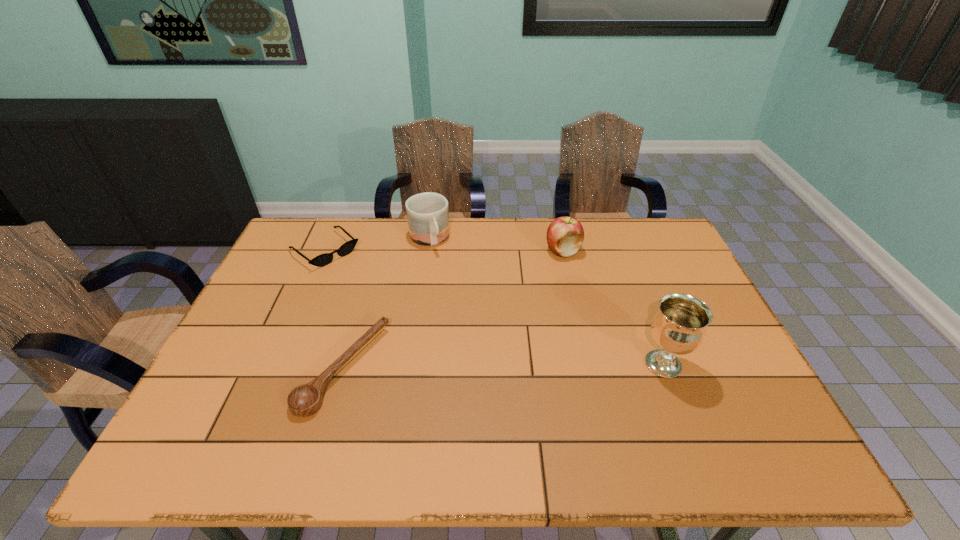
What are the coordinates of `vacant space that's between the tallest object and the wooden spoon` in the screenshot? It's located at (503, 366).

Identify the location of free space between the wooden spoon and the tallest object. The height and width of the screenshot is (540, 960). (503, 366).

I want to click on free space between the tallest object and the apple, so click(612, 307).

Image resolution: width=960 pixels, height=540 pixels. I want to click on free space between the rightmost object and the wooden spoon, so click(x=503, y=366).

The image size is (960, 540). I want to click on vacant space that's between the rightmost object and the sunglasses, so click(494, 307).

Locate an element on the screen. This screenshot has width=960, height=540. empty space that is in between the tallest object and the mug is located at coordinates (546, 302).

Locate an element on the screen. vacant region between the chalice and the mug is located at coordinates (546, 302).

Find the location of a particular element. blank region between the chalice and the sunglasses is located at coordinates (494, 307).

At what (x,y) coordinates should I click in order to perform the action: click on object that is the fourth closest one to the wooden spoon. Please return your answer as a coordinate pair (x, y). This screenshot has width=960, height=540. Looking at the image, I should click on (679, 326).

Locate an element on the screen. The width and height of the screenshot is (960, 540). object that is the fourth closest to the tallest object is located at coordinates (324, 259).